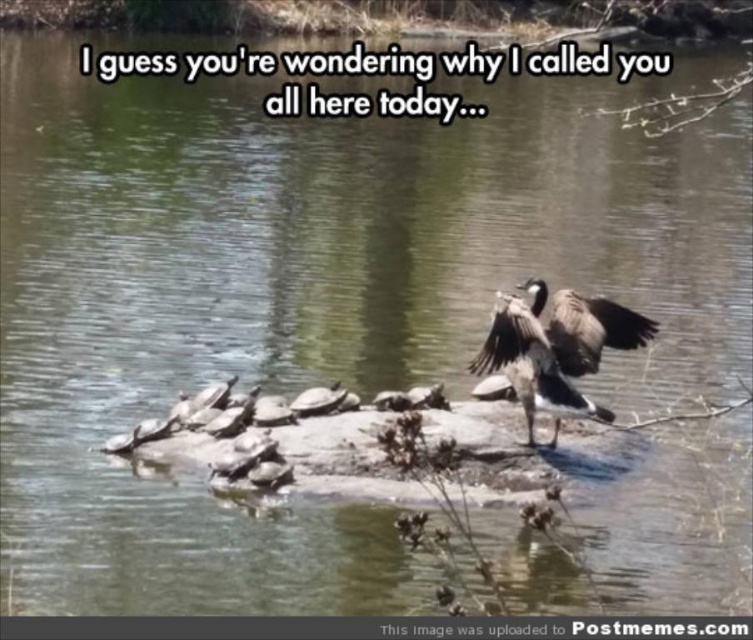
Can you confirm if gray feathered goose at center is positioned to the left of matte gray wing at upper right?

Correct, you'll find gray feathered goose at center to the left of matte gray wing at upper right.

Is gray feathered goose at center wider than matte gray wing at upper right?

Indeed, gray feathered goose at center has a greater width compared to matte gray wing at upper right.

Where is `gray feathered goose at center`? gray feathered goose at center is located at coordinates (556, 348).